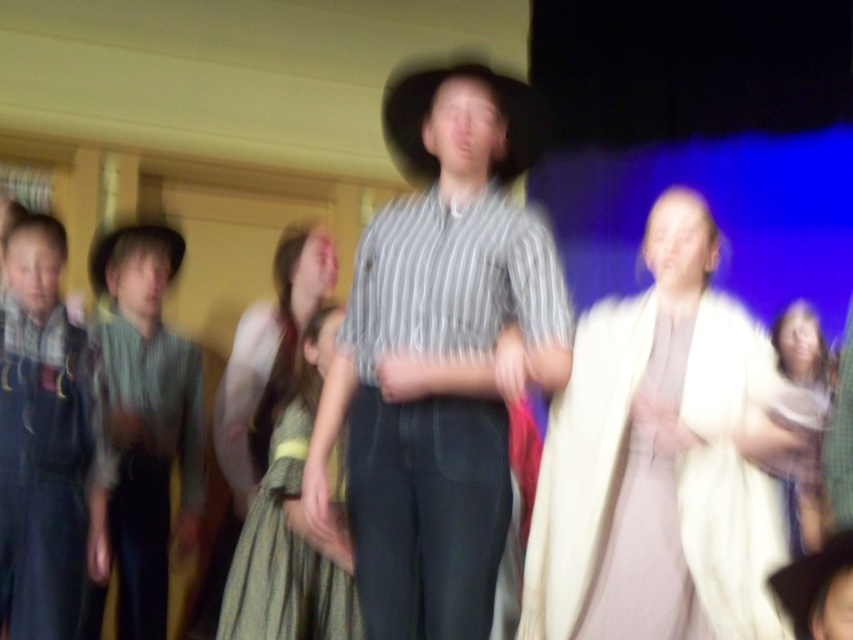
Question: Which point is closer to the camera?

Choices:
 (A) striped cotton shirt at center
 (B) green textured fabric dress at center

Answer: (A)

Question: Does dark green fabric robe at left have a lesser width compared to light beige fabric at right?

Choices:
 (A) no
 (B) yes

Answer: (B)

Question: Is light beige fabric dress at center further to camera compared to striped fabric shirt at left?

Choices:
 (A) no
 (B) yes

Answer: (A)

Question: Which of the following is the closest to the observer?

Choices:
 (A) (103, 260)
 (B) (318, 579)
 (C) (755, 365)

Answer: (C)

Question: Can you confirm if brown felt cowboy hat at center is thinner than light beige fabric at right?

Choices:
 (A) no
 (B) yes

Answer: (A)

Question: Considering the real-world distances, which object is farthest from the light beige fabric at right?

Choices:
 (A) green textured fabric dress at center
 (B) striped fabric shirt at left

Answer: (B)